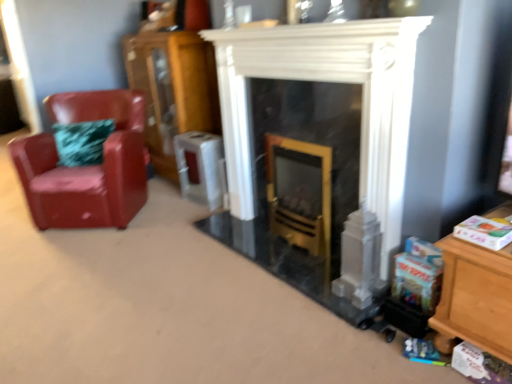
Question: Does wooden cabinet at left come behind white marble fireplace at center?

Choices:
 (A) no
 (B) yes

Answer: (B)

Question: From the image's perspective, is wooden cabinet at left beneath white marble fireplace at center?

Choices:
 (A) no
 (B) yes

Answer: (A)

Question: From a real-world perspective, is wooden cabinet at left on white marble fireplace at center?

Choices:
 (A) no
 (B) yes

Answer: (B)

Question: Is wooden cabinet at left completely or partially outside of white marble fireplace at center?

Choices:
 (A) yes
 (B) no

Answer: (A)

Question: Is wooden cabinet at left oriented towards white marble fireplace at center?

Choices:
 (A) yes
 (B) no

Answer: (B)

Question: From the image's perspective, does wooden cabinet at left appear higher than white marble fireplace at center?

Choices:
 (A) yes
 (B) no

Answer: (A)

Question: Is white marble fireplace at center taller than glossy leather chair at left?

Choices:
 (A) yes
 (B) no

Answer: (A)

Question: Is white marble fireplace at center at the right side of glossy leather chair at left?

Choices:
 (A) no
 (B) yes

Answer: (B)

Question: Is white marble fireplace at center thinner than glossy leather chair at left?

Choices:
 (A) no
 (B) yes

Answer: (B)

Question: Does white marble fireplace at center have a larger size compared to glossy leather chair at left?

Choices:
 (A) yes
 (B) no

Answer: (B)

Question: Is white marble fireplace at center positioned with its back to glossy leather chair at left?

Choices:
 (A) yes
 (B) no

Answer: (B)

Question: From the image's perspective, does white marble fireplace at center appear higher than glossy leather chair at left?

Choices:
 (A) no
 (B) yes

Answer: (A)

Question: Is glossy leather chair at left closer to the viewer compared to white marble fireplace at center?

Choices:
 (A) no
 (B) yes

Answer: (A)